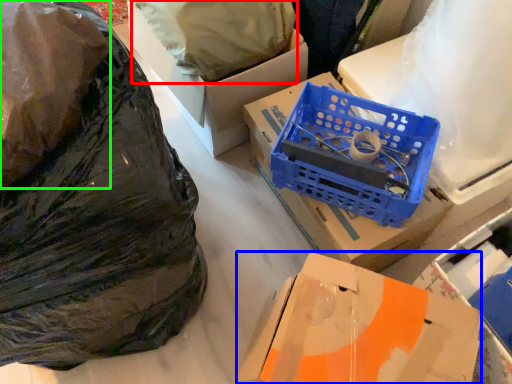
Question: Which object is the closest to the wrapping paper (highlighted by a red box)? Choose among these: box (highlighted by a blue box) or plastic bag (highlighted by a green box).

Choices:
 (A) box
 (B) plastic bag

Answer: (B)